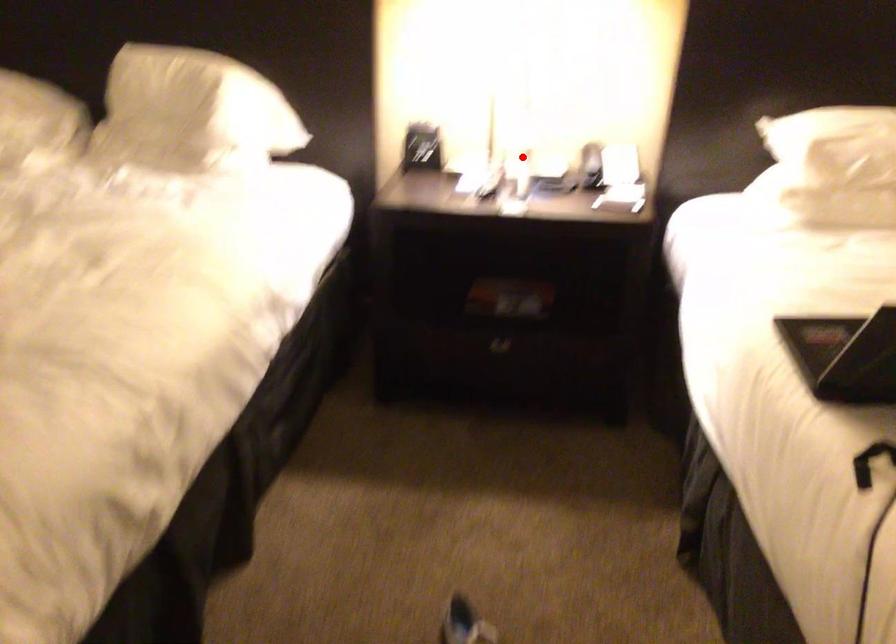
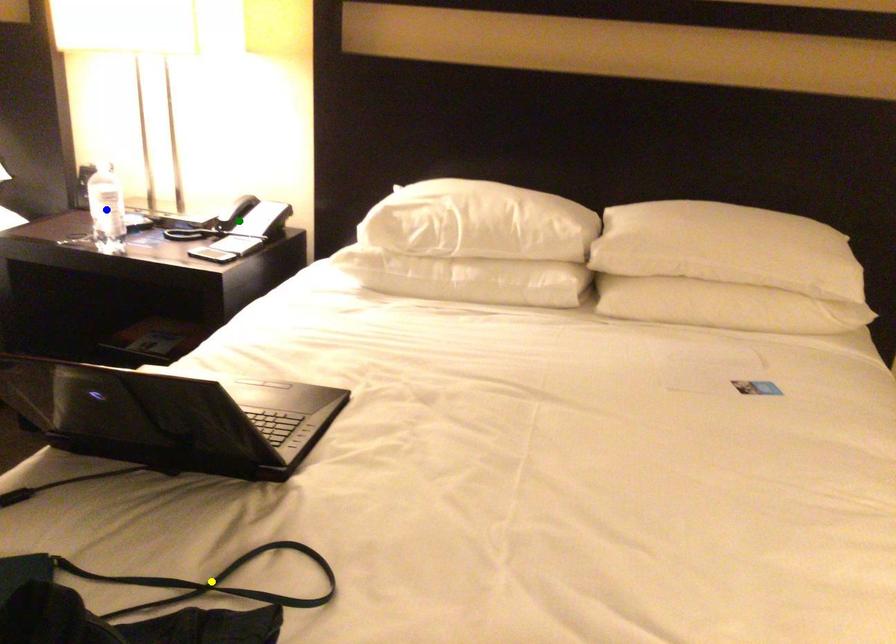
Question: I am providing you with two images of the same scene from different viewpoints. A red point is marked on the first image. You are given multiple points on the second image. Which spot in image 2 lines up with the point in image 1?

Choices:
 (A) green point
 (B) blue point
 (C) yellow point

Answer: (B)